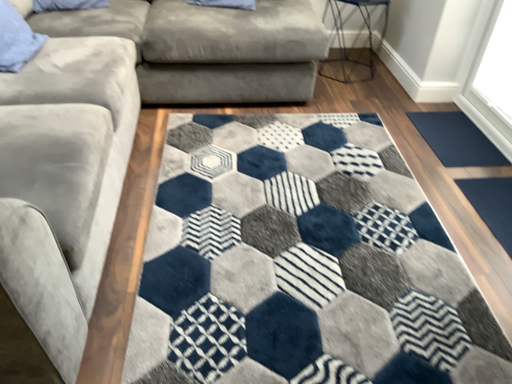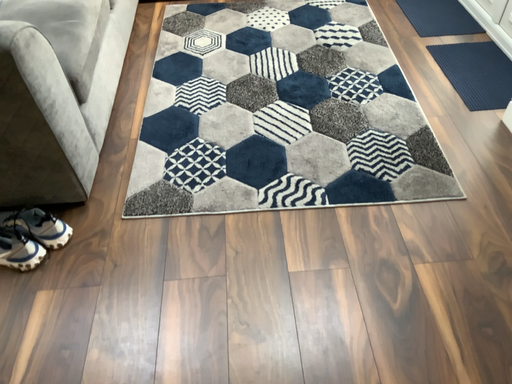
Question: How did the camera likely rotate when shooting the video?

Choices:
 (A) rotated downward
 (B) rotated upward

Answer: (A)